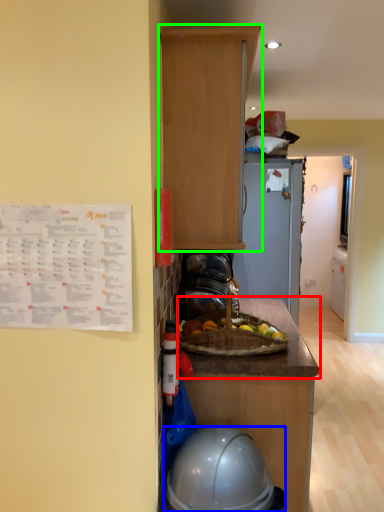
Question: Which is farther away from countertop (highlighted by a red box)? helmet (highlighted by a blue box) or cabinetry (highlighted by a green box)?

Choices:
 (A) helmet
 (B) cabinetry

Answer: (B)